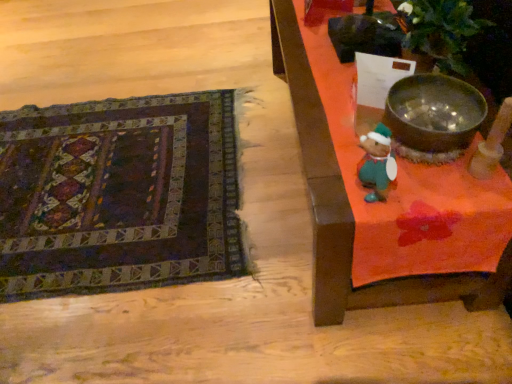
The height and width of the screenshot is (384, 512). Find the location of `free point above dark woven rug at lower left (from a real-world perspective)`. free point above dark woven rug at lower left (from a real-world perspective) is located at coordinates (100, 178).